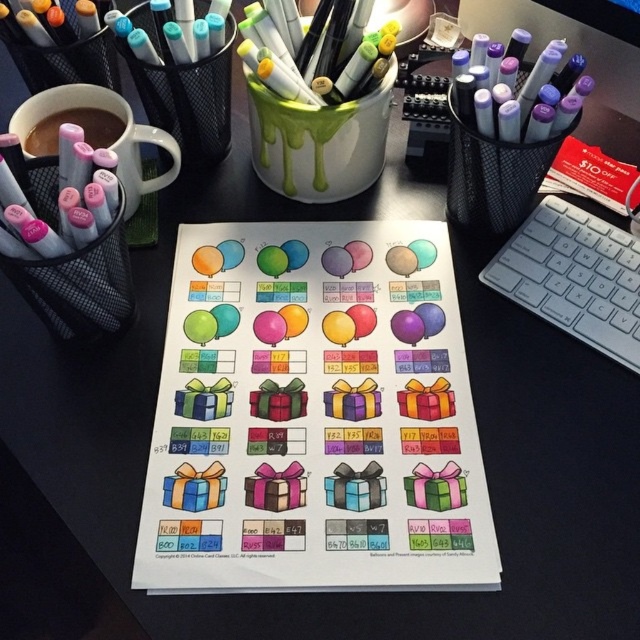
You are an artist working on a project and need to locate the purple matte marker at upper right. According to the coordinates provided, where exactly should you look on the desk?

The purple matte marker at upper right is located at coordinates point [508,140].

You are an artist holding a ruler that is 12 inches long. You want to measure the distance from your position to the purple matte marker at upper right. Can your ruler reach it?

The distance between the purple matte marker at upper right and the viewer is 16.88 inches, which is longer than the 12 inches ruler. Therefore, the ruler cannot reach the purple matte marker at upper right.

You are an artist who needs to choose between the purple matte marker at upper right and the matte white mug at upper left for a project that requires a taller object. Which one should you pick?

The purple matte marker at upper right is taller than the matte white mug at upper left, so you should pick the purple matte marker at upper right.